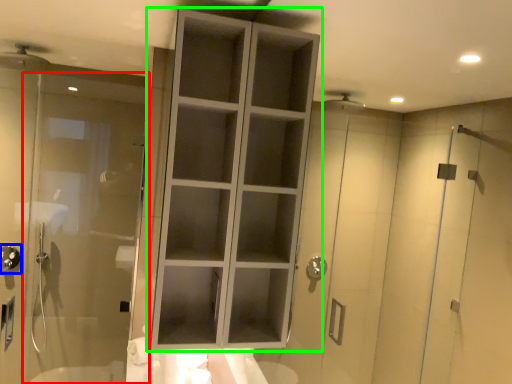
Question: Estimate the real-world distances between objects in this image. Which object is closer to door (highlighted by a red box), shower (highlighted by a blue box) or cupboard (highlighted by a green box)?

Choices:
 (A) shower
 (B) cupboard

Answer: (A)